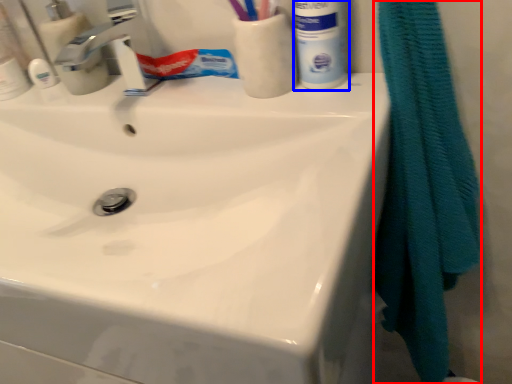
Question: Which object appears closest to the camera in this image, bath towel (highlighted by a red box) or mouthwash (highlighted by a blue box)?

Choices:
 (A) bath towel
 (B) mouthwash

Answer: (A)